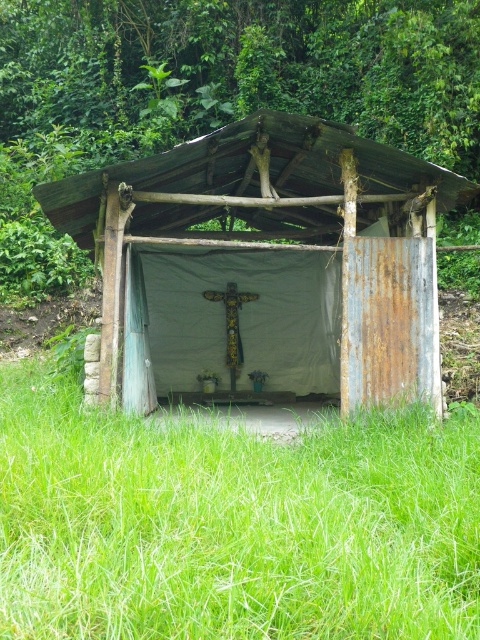
You are standing in front of the shrine and want to place a large picnic blanket on the ground. The blanket is as wide as the rusty metal hut at center. Will the blanket fit entirely within the green grass at lower center area?

The green grass at lower center is wider than the rusty metal hut at center, so the blanket, which is as wide as the rusty metal hut at center, will fit entirely within the green grass at lower center area.

You are standing at the entrance of the rustic shrine and want to move towards the point labeled as point (50,596). However, there is an obstacle at point (363,332). Will you encounter the obstacle before reaching your destination?

Point (50,596) is in front of point (363,332), so you will reach the destination before encountering the obstacle.

You are standing at the entrance of the rustic outdoor structure and want to place a small offering on the green grass at lower center. Based on the coordinates provided, can you determine the exact location to place it?

The green grass at lower center is located at point (231, 524), so you should place the offering at those coordinates.